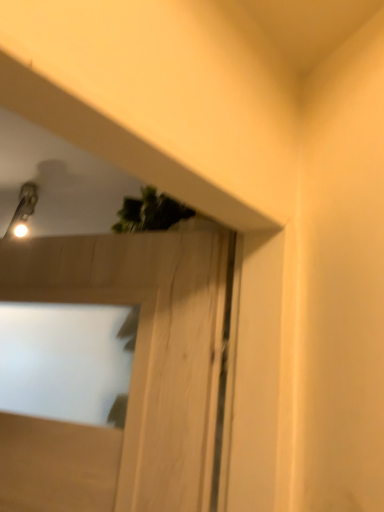
What are the coordinates of `matte silver light fixture at upper left` in the screenshot? It's located at (23, 211).

What do you see at coordinates (23, 211) in the screenshot?
I see `matte silver light fixture at upper left` at bounding box center [23, 211].

The height and width of the screenshot is (512, 384). Identify the location of matte silver light fixture at upper left. (23, 211).